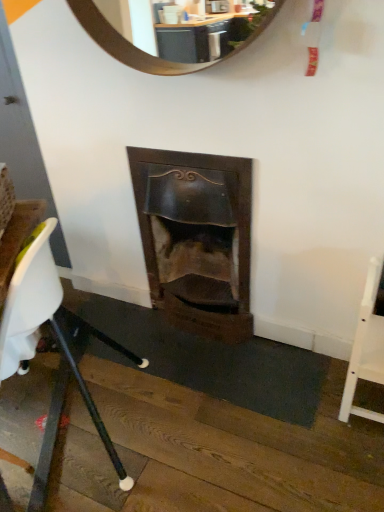
At what (x,y) coordinates should I click in order to perform the action: click on free location to the left of wooden fireplace at center. Please return your answer as a coordinate pair (x, y). Looking at the image, I should click on (120, 326).